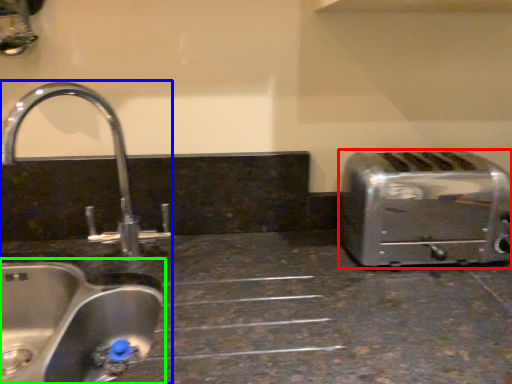
Question: Which object is positioned closest to toaster (highlighted by a red box)? Select from sink (highlighted by a blue box) and sink (highlighted by a green box).

Choices:
 (A) sink
 (B) sink

Answer: (B)